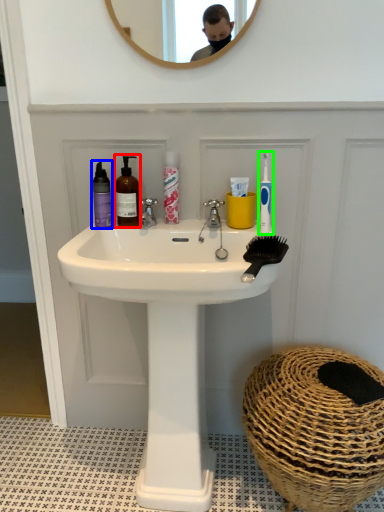
Question: Which object is the farthest from mouthwash (highlighted by a red box)? Choose among these: mouthwash (highlighted by a blue box) or toothbrush (highlighted by a green box).

Choices:
 (A) mouthwash
 (B) toothbrush

Answer: (B)